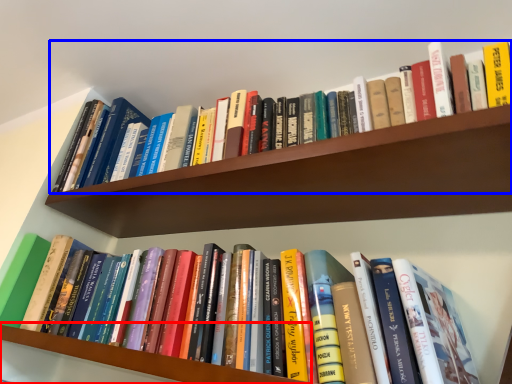
Question: Which object appears farthest to the camera in this image, shelf (highlighted by a red box) or book (highlighted by a blue box)?

Choices:
 (A) shelf
 (B) book

Answer: (B)